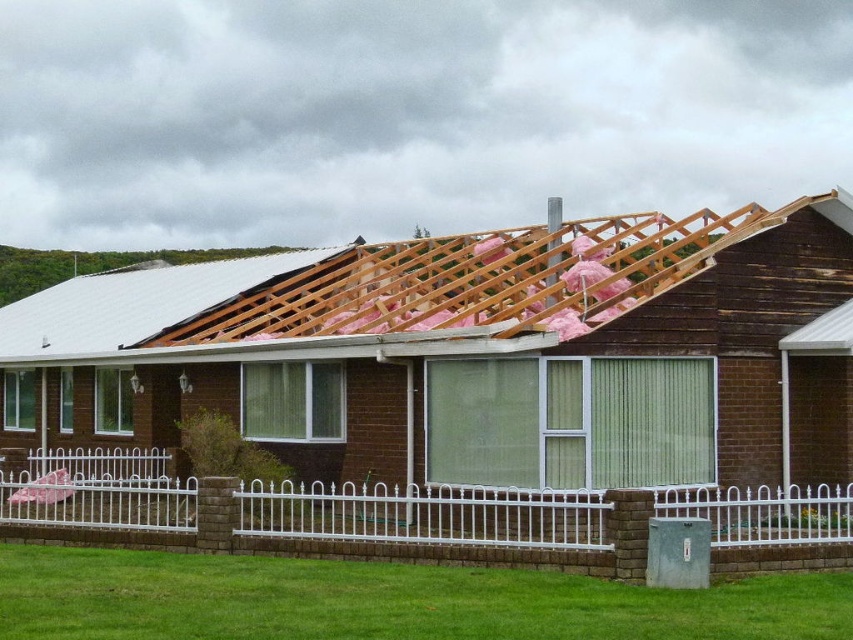
Does wooden beams at upper center appear on the left side of white metal fence at lower center?

Correct, you'll find wooden beams at upper center to the left of white metal fence at lower center.

Between wooden beams at upper center and white metal fence at lower center, which one appears on the right side from the viewer's perspective?

white metal fence at lower center is more to the right.

Locate an element on the screen. wooden beams at upper center is located at coordinates (387, 291).